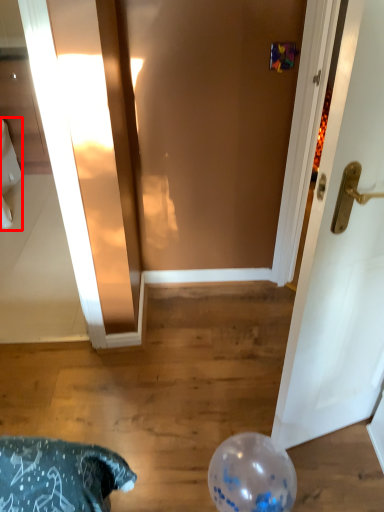
Question: Considering the relative positions of toilet bowl (annotated by the red box) and balloon in the image provided, where is toilet bowl (annotated by the red box) located with respect to the staircase?

Choices:
 (A) right
 (B) left

Answer: (B)